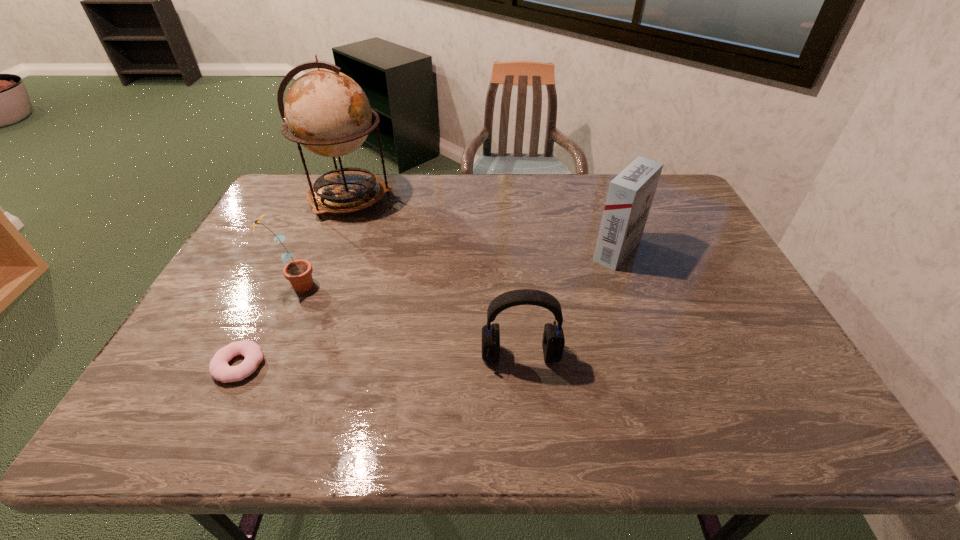
You are a GUI agent. You are given a task and a screenshot of the screen. Output one action in this format:
    pyautogui.click(x=<x>, y=<y>)
    Task: Click on the tallest object
    The height and width of the screenshot is (540, 960).
    Given the screenshot: What is the action you would take?
    pyautogui.click(x=327, y=112)

Where is `the farthest object`? The width and height of the screenshot is (960, 540). the farthest object is located at coordinates (327, 112).

Locate an element on the screen. The image size is (960, 540). the second farthest object is located at coordinates (630, 195).

I want to click on the rightmost object, so click(630, 195).

This screenshot has width=960, height=540. Find the location of `sunflower`. sunflower is located at coordinates (299, 272).

Find the location of a particular element. The image size is (960, 540). the fourth tallest object is located at coordinates (553, 342).

This screenshot has width=960, height=540. In order to click on headset in this screenshot , I will do `click(553, 342)`.

You are a GUI agent. You are given a task and a screenshot of the screen. Output one action in this format:
    pyautogui.click(x=<x>, y=<y>)
    Task: Click on the shortest object
    
    Given the screenshot: What is the action you would take?
    pyautogui.click(x=219, y=369)

Find the location of `blank space located at the center of the tallest object`. blank space located at the center of the tallest object is located at coordinates coord(488,198).

Locate an element on the screen. vacant space located on the right of the cigarette case is located at coordinates (698, 251).